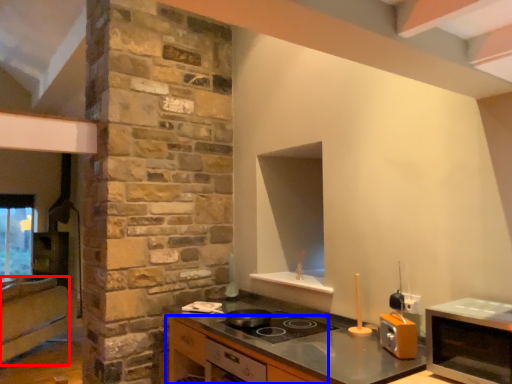
Question: Which of the following is the farthest to the observer, cabinetry (highlighted by a red box) or cabinetry (highlighted by a blue box)?

Choices:
 (A) cabinetry
 (B) cabinetry

Answer: (A)